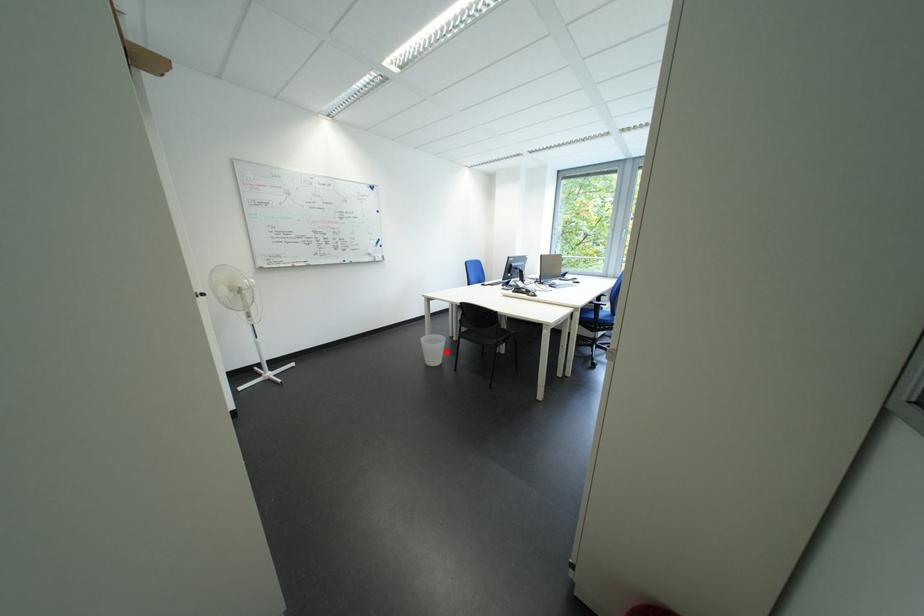
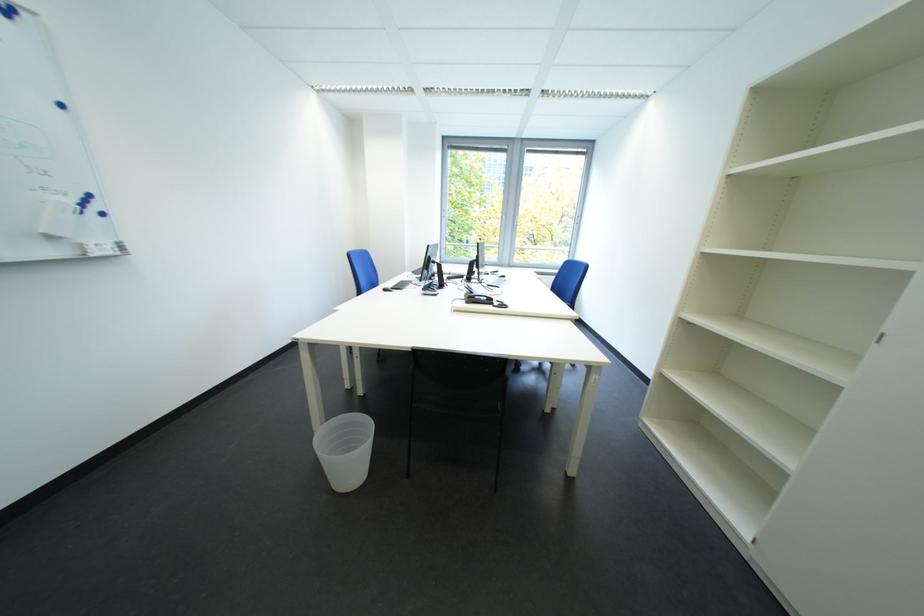
Locate, in the second image, the point that corresponds to the highlighted location in the first image.

(362, 455)